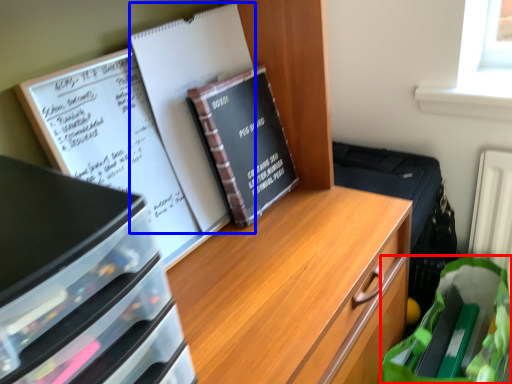
Question: Which object appears farthest to the camera in this image, grocery bag (highlighted by a red box) or journal (highlighted by a blue box)?

Choices:
 (A) grocery bag
 (B) journal

Answer: (A)